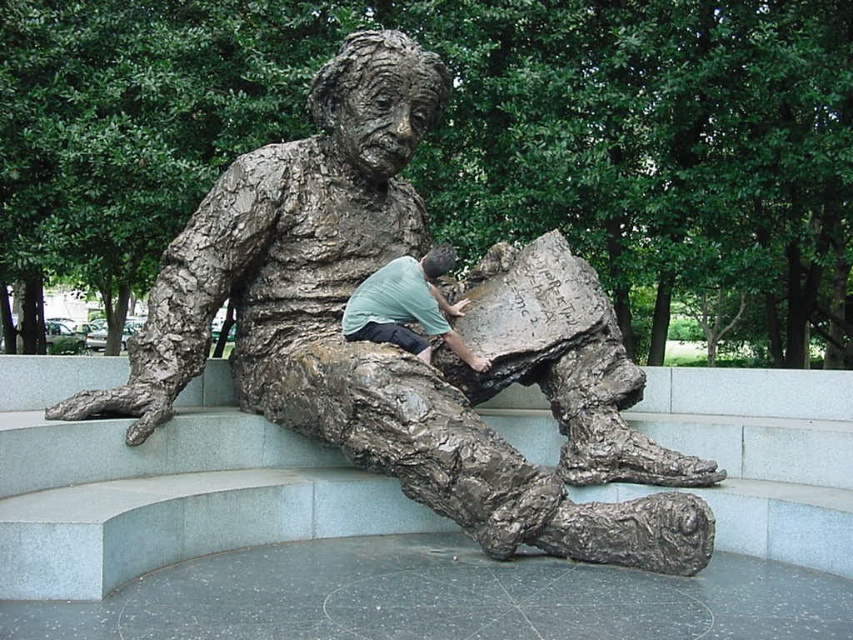
Is bronze statue at center smaller than green matte shirt at center?

Actually, bronze statue at center might be larger than green matte shirt at center.

In the scene shown: Is bronze statue at center to the right of green matte shirt at center from the viewer's perspective?

In fact, bronze statue at center is to the left of green matte shirt at center.

Image resolution: width=853 pixels, height=640 pixels. In order to click on bronze statue at center in this screenshot , I will do `click(390, 346)`.

Locate an element on the screen. The width and height of the screenshot is (853, 640). bronze statue at center is located at coordinates (390, 346).